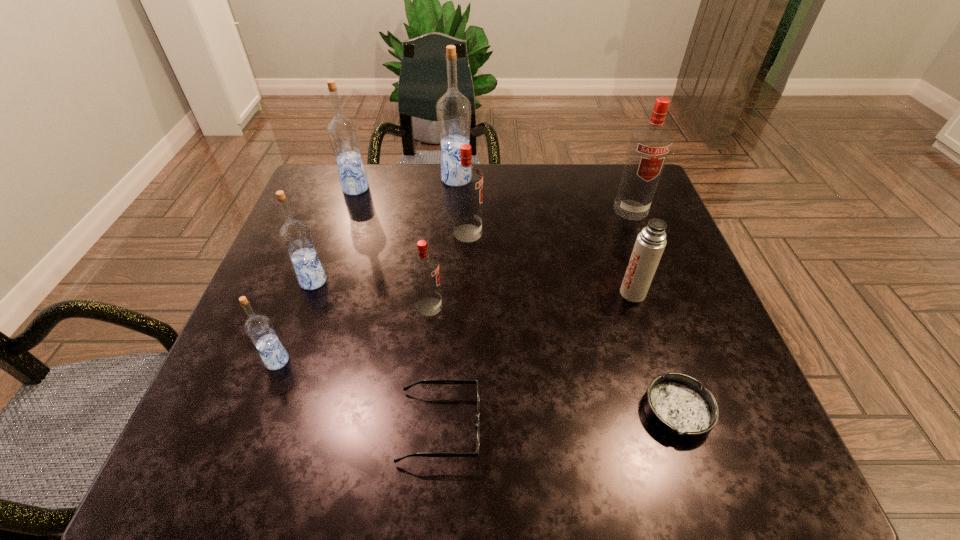
Where is `vacant space at the far right corner of the desktop`? The width and height of the screenshot is (960, 540). vacant space at the far right corner of the desktop is located at coordinates (609, 166).

This screenshot has height=540, width=960. In order to click on free area in between the second red vodka from left to right and the nearest vodka in this screenshot , I will do `click(372, 297)`.

Identify the location of unoccupied area between the fourth farthest vodka and the farthest red vodka. (549, 221).

Identify the location of vacant space that's between the sunglasses and the ashtray. (559, 419).

Find the location of a particular element. vacant point located between the thermos bottle and the seventh nearest object is located at coordinates (550, 263).

Where is `empty location between the fifth nearest vodka and the ashtray`? The width and height of the screenshot is (960, 540). empty location between the fifth nearest vodka and the ashtray is located at coordinates (654, 310).

The height and width of the screenshot is (540, 960). Identify the location of free space between the second smallest blue vodka and the nearest vodka. (296, 321).

This screenshot has height=540, width=960. I want to click on free space that is in between the fourth farthest object and the fifth nearest vodka, so click(x=549, y=221).

Where is `free space between the third biggest blue vodka and the ashtray`? free space between the third biggest blue vodka and the ashtray is located at coordinates tap(495, 346).

Select which object is the second closest to the sunglasses. Please provide its 2D coordinates. Your answer should be formatted as a tuple, i.e. [(x, y)], where the tuple contains the x and y coordinates of a point satisfying the conditions above.

[(259, 329)]